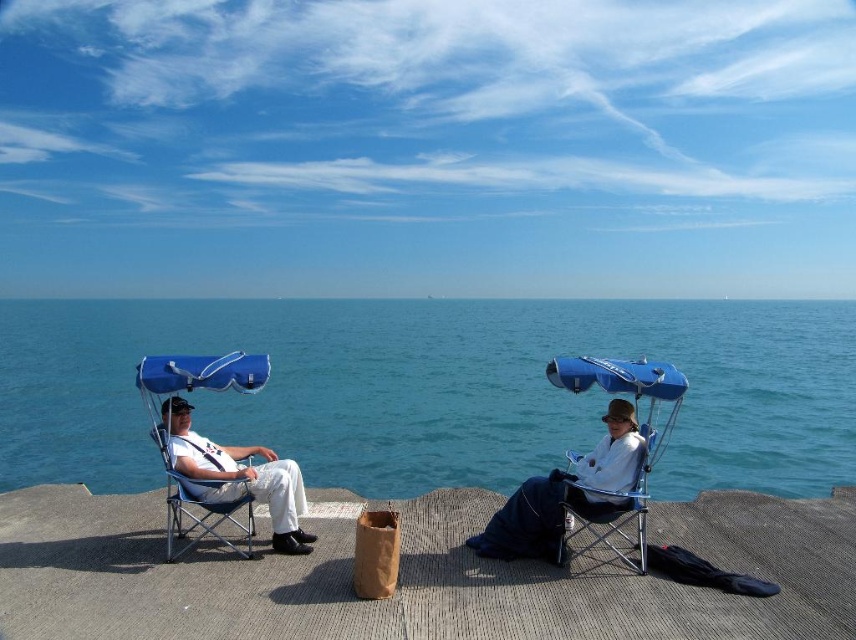
You are standing at the point marked by the coordinates point (417, 577). Looking around, you see the two individuals under blue canopy umbrellas. Which direction should you face to see the concrete dock at center?

The point marked by the coordinates point (417, 577) is the concrete dock at center itself, so you are already facing it directly.

You are a delivery robot with a 1.2 meter wide package. You need to navigate through the space between the concrete dock at center and the matte blue folding chair at center to reach the delivery point. Can your package fit through the space?

The concrete dock at center and matte blue folding chair at center are 3.71 meters apart from each other. Since the package is 1.2 meters wide, it can fit through the space as the distance between them is wider than the package.